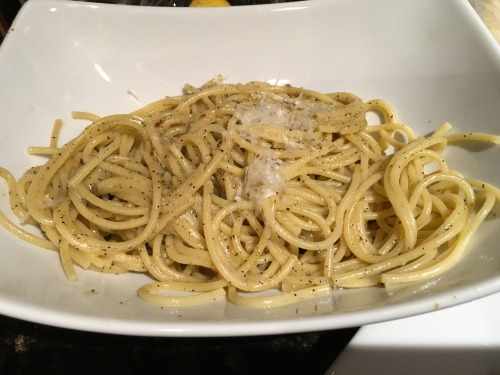
Identify the location of plate. The image size is (500, 375). (386, 39).